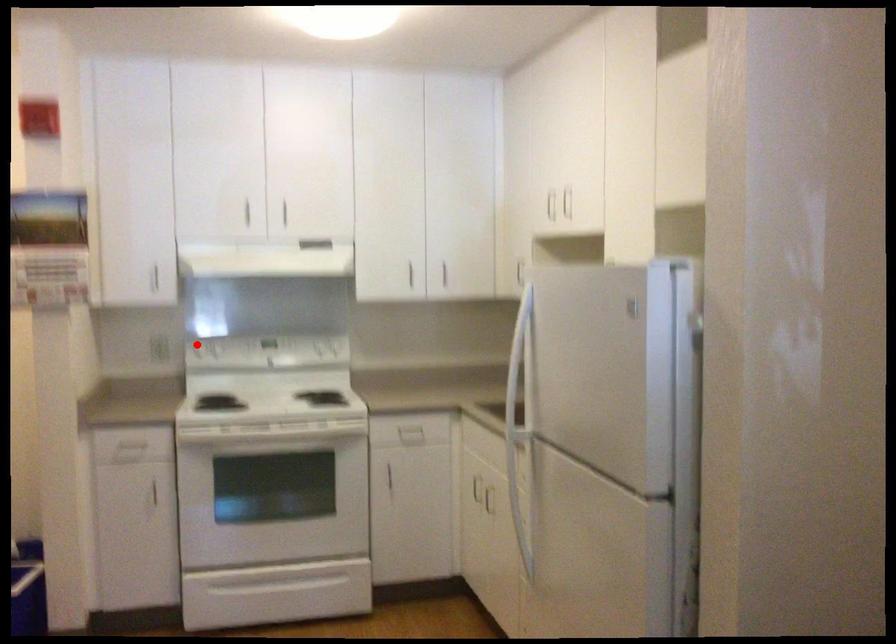
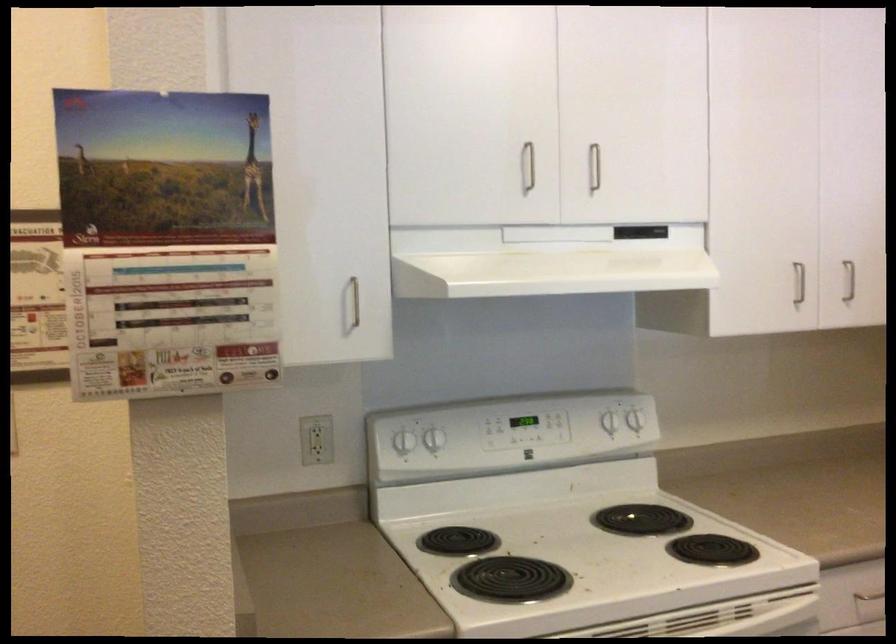
Question: I am providing you with two images of the same scene from different viewpoints. In image1, a red point is highlighted. Considering the same 3D point in image2, which of the following is correct?

Choices:
 (A) It is closer
 (B) It is farther

Answer: (A)